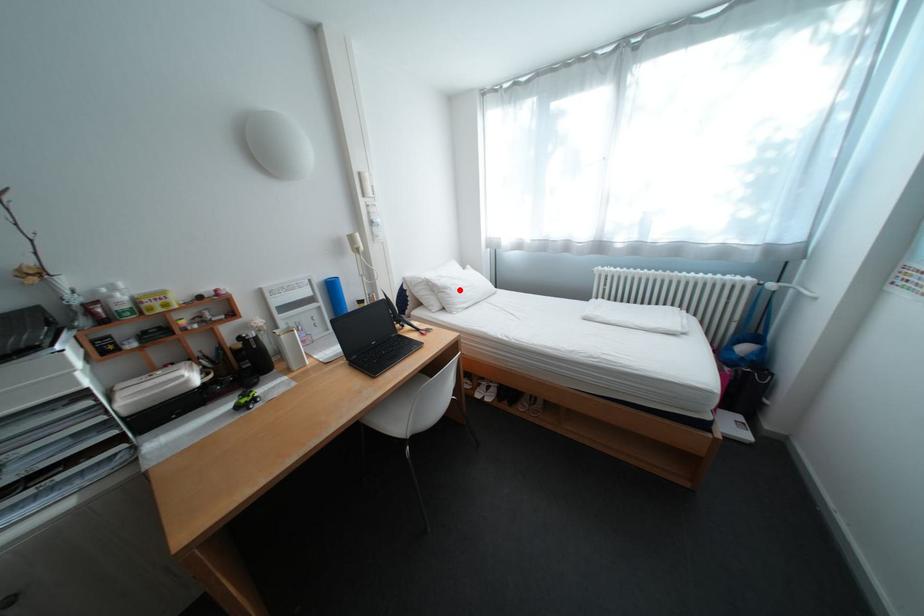
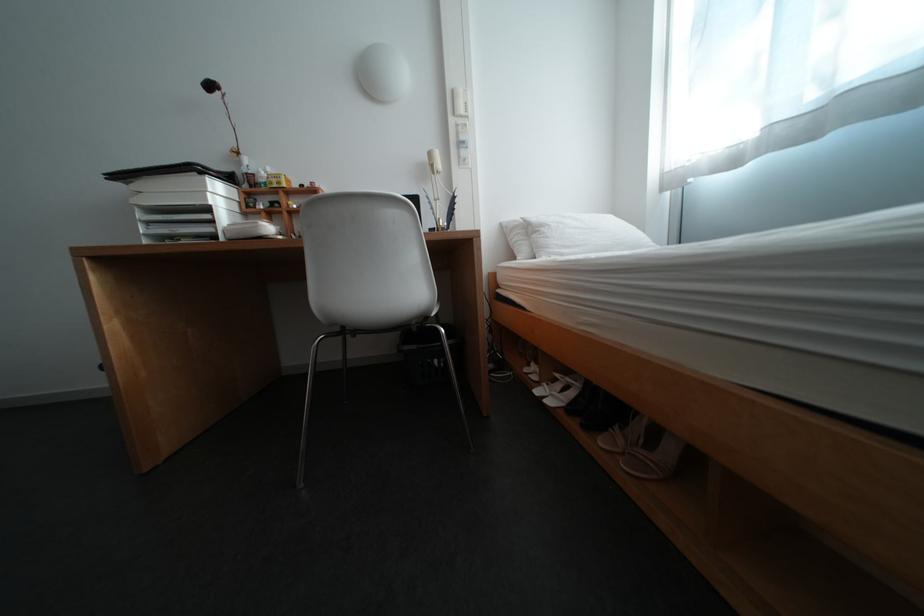
In the second image, find the point that corresponds to the highlighted location in the first image.

(555, 228)